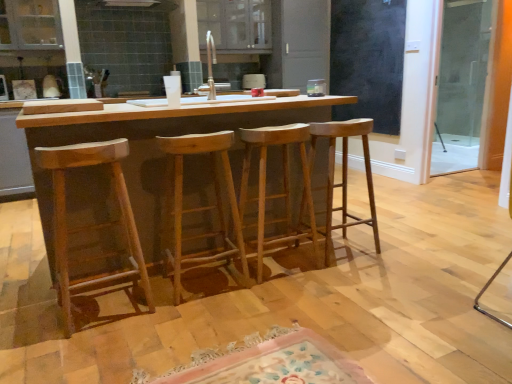
Find the location of a particular element. The image size is (512, 384). unoccupied area in front of natural wood stool at center, which is the third stool from right to left is located at coordinates click(197, 319).